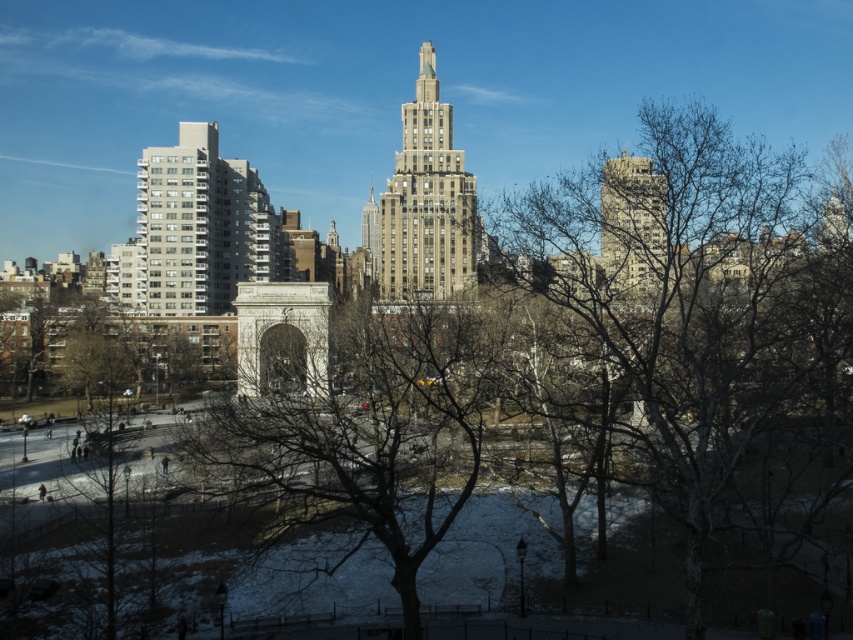
Is smooth concrete building at upper right wider than smooth beige skyscraper at center?

Indeed, smooth concrete building at upper right has a greater width compared to smooth beige skyscraper at center.

The height and width of the screenshot is (640, 853). In order to click on smooth concrete building at upper right in this screenshot , I will do `click(633, 227)`.

Which is above, bare bark tree at center or brown textured building at center?

brown textured building at center is above.

Does bare bark tree at center have a smaller size compared to brown textured building at center?

Incorrect, bare bark tree at center is not smaller in size than brown textured building at center.

Is point (682, 477) behind point (419, 106)?

No, it is not.

Where is `bare bark tree at center`? bare bark tree at center is located at coordinates (711, 323).

From the picture: Is gray concrete building at left above smooth concrete building at upper right?

Indeed, gray concrete building at left is positioned over smooth concrete building at upper right.

Measure the distance between point [252,195] and camera.

585.86 feet

This screenshot has height=640, width=853. Identify the location of gray concrete building at left. click(x=200, y=227).